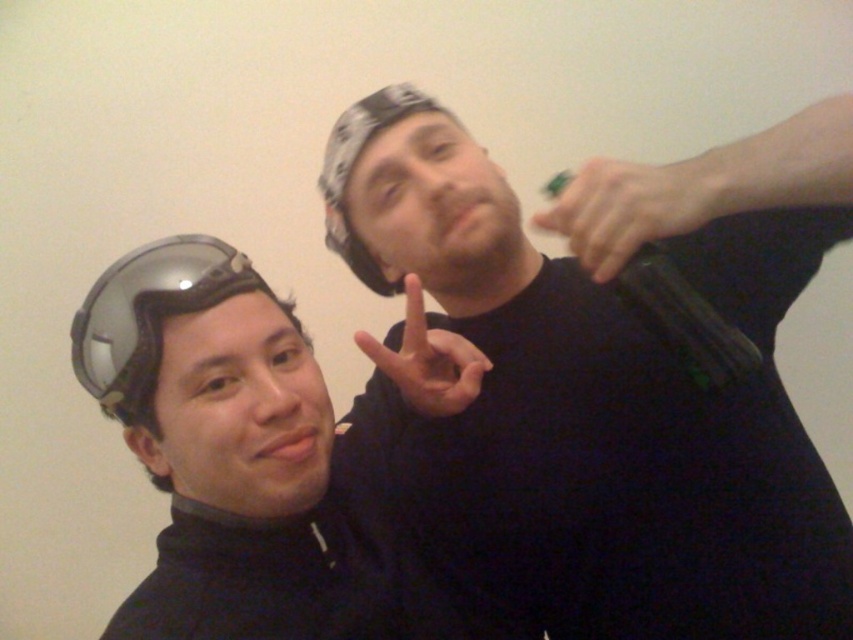
Question: Can you confirm if green matte hand at upper right is positioned to the left of green matte toy at upper center?

Choices:
 (A) yes
 (B) no

Answer: (B)

Question: Based on their relative distances, which object is farther from the green matte hand at upper right?

Choices:
 (A) green matte toy at upper center
 (B) matte black helmet at left
 (C) transparent plastic goggles at left

Answer: (C)

Question: Which of the following is the closest to the observer?

Choices:
 (A) black matte shirt at upper right
 (B) matte black helmet at left
 (C) green matte hand at upper right

Answer: (C)

Question: Is the position of transparent plastic goggles at left less distant than that of matte black hand at center?

Choices:
 (A) no
 (B) yes

Answer: (B)

Question: Does matte black helmet at left appear over green matte hand at upper right?

Choices:
 (A) yes
 (B) no

Answer: (B)

Question: Which of these objects is positioned closest to the green matte toy at upper center?

Choices:
 (A) matte black hand at center
 (B) black matte shirt at upper right
 (C) green matte hand at upper right

Answer: (C)